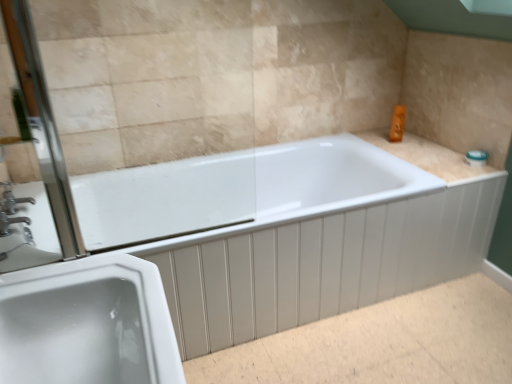
Locate an element on the screen. clear glass screen door at left is located at coordinates (42, 125).

What is the approximate height of clear glass screen door at left?

clear glass screen door at left is 30.35 inches in height.

You are a GUI agent. You are given a task and a screenshot of the screen. Output one action in this format:
    pyautogui.click(x=<x>, y=<y>)
    Task: Click on the white glossy sink at lower left
    This screenshot has width=512, height=384.
    Given the screenshot: What is the action you would take?
    pyautogui.click(x=87, y=324)

The width and height of the screenshot is (512, 384). What do you see at coordinates (432, 158) in the screenshot?
I see `beige tile counter top at upper right` at bounding box center [432, 158].

What are the coordinates of `clear glass screen door at left` in the screenshot? It's located at (42, 125).

The height and width of the screenshot is (384, 512). What are the coordinates of `sink above the silver metallic faucet at left (from a real-world perspective)` in the screenshot? It's located at (87, 324).

Considering the points (16, 210) and (29, 313), which point is behind, point (16, 210) or point (29, 313)?

The point (16, 210) is farther.

Would you say silver metallic faucet at left is inside or outside white glossy sink at lower left?

silver metallic faucet at left lies outside white glossy sink at lower left.

From the image's perspective, which one is positioned higher, silver metallic faucet at left or white glossy sink at lower left?

From the image's view, silver metallic faucet at left is above.

Find the location of `tap that is on the left side of white glossy bathtub at center`. tap that is on the left side of white glossy bathtub at center is located at coordinates (11, 209).

Could you tell me if white glossy bathtub at center is turned towards silver metallic faucet at left?

No, white glossy bathtub at center does not turn towards silver metallic faucet at left.

Can you confirm if white glossy bathtub at center is positioned to the left of silver metallic faucet at left?

Incorrect, white glossy bathtub at center is not on the left side of silver metallic faucet at left.

Is clear glass screen door at left far from silver metallic faucet at left?

No, clear glass screen door at left is in close proximity to silver metallic faucet at left.

In the scene shown: Is clear glass screen door at left thinner than silver metallic faucet at left?

Yes, clear glass screen door at left is thinner than silver metallic faucet at left.

Who is bigger, clear glass screen door at left or silver metallic faucet at left?

Bigger between the two is clear glass screen door at left.

Does white glossy sink at lower left touch beige tile counter top at upper right?

There is a gap between white glossy sink at lower left and beige tile counter top at upper right.

From the image's perspective, would you say white glossy sink at lower left is positioned over beige tile counter top at upper right?

No.

Is point (93, 304) closer to camera compared to point (433, 162)?

Yes.

There is a white glossy bathtub at center. Find the location of `counter top above it (from a real-world perspective)`. counter top above it (from a real-world perspective) is located at coordinates (432, 158).

Is white glossy bathtub at center turned away from beige tile counter top at upper right?

No, white glossy bathtub at center is not facing away from beige tile counter top at upper right.

Relative to beige tile counter top at upper right, is white glossy bathtub at center in front or behind?

white glossy bathtub at center is positioned closer to the viewer than beige tile counter top at upper right.

From the image's perspective, is white glossy bathtub at center beneath beige tile counter top at upper right?

Yes, from the image's perspective, white glossy bathtub at center is beneath beige tile counter top at upper right.

From a real-world perspective, who is located lower, white glossy bathtub at center or white glossy sink at lower left?

white glossy bathtub at center, from a real-world perspective.

The image size is (512, 384). In order to click on sink above the white glossy bathtub at center (from a real-world perspective) in this screenshot , I will do `click(87, 324)`.

Can you confirm if white glossy bathtub at center is positioned to the left of white glossy sink at lower left?

No.

Who is bigger, white glossy bathtub at center or white glossy sink at lower left?

With larger size is white glossy bathtub at center.

Can you tell me how much clear glass screen door at left and white glossy bathtub at center differ in facing direction?

clear glass screen door at left and white glossy bathtub at center are facing 0.0368 degrees away from each other.

From the image's perspective, is clear glass screen door at left located above white glossy bathtub at center?

Indeed, from the image's perspective, clear glass screen door at left is shown above white glossy bathtub at center.

Considering the positions of points (46, 178) and (266, 223), is point (46, 178) closer to camera compared to point (266, 223)?

Yes, point (46, 178) is closer to viewer.

Between clear glass screen door at left and white glossy bathtub at center, which one has less height?

With less height is white glossy bathtub at center.

Where is `sink on the right of silver metallic faucet at left`? sink on the right of silver metallic faucet at left is located at coordinates (87, 324).

The image size is (512, 384). I want to click on tap lying behind the white glossy bathtub at center, so click(11, 209).

When comparing their distances from beige tile counter top at upper right, does white glossy sink at lower left or silver metallic faucet at left seem further?

Among the two, silver metallic faucet at left is located further to beige tile counter top at upper right.

Based on their spatial positions, is silver metallic faucet at left or white glossy bathtub at center closer to beige tile counter top at upper right?

white glossy bathtub at center is positioned closer to the anchor beige tile counter top at upper right.

Estimate the real-world distances between objects in this image. Which object is closer to white glossy sink at lower left, silver metallic faucet at left or beige tile counter top at upper right?

silver metallic faucet at left is closer to white glossy sink at lower left.

Which object lies further to the anchor point beige tile counter top at upper right, clear glass screen door at left or silver metallic faucet at left?

silver metallic faucet at left is further to beige tile counter top at upper right.

Based on their spatial positions, is white glossy bathtub at center or beige tile counter top at upper right further from silver metallic faucet at left?

Among the two, beige tile counter top at upper right is located further to silver metallic faucet at left.

When comparing their distances from silver metallic faucet at left, does beige tile counter top at upper right or clear glass screen door at left seem closer?

clear glass screen door at left is positioned closer to the anchor silver metallic faucet at left.

When comparing their distances from beige tile counter top at upper right, does silver metallic faucet at left or clear glass screen door at left seem closer?

clear glass screen door at left is closer to beige tile counter top at upper right.

Estimate the real-world distances between objects in this image. Which object is further from silver metallic faucet at left, white glossy sink at lower left or clear glass screen door at left?

white glossy sink at lower left.

The width and height of the screenshot is (512, 384). In order to click on bathtub located between clear glass screen door at left and beige tile counter top at upper right in the left-right direction in this screenshot , I will do `click(330, 243)`.

Where is `bathtub between white glossy sink at lower left and beige tile counter top at upper right from left to right`? bathtub between white glossy sink at lower left and beige tile counter top at upper right from left to right is located at coordinates (330, 243).

You are a GUI agent. You are given a task and a screenshot of the screen. Output one action in this format:
    pyautogui.click(x=<x>, y=<y>)
    Task: Click on the screen door located between white glossy sink at lower left and white glossy bathtub at center in the depth direction
    This screenshot has height=384, width=512.
    Given the screenshot: What is the action you would take?
    pyautogui.click(x=42, y=125)

At what (x,y) coordinates should I click in order to perform the action: click on sink between clear glass screen door at left and beige tile counter top at upper right from left to right. Please return your answer as a coordinate pair (x, y). The height and width of the screenshot is (384, 512). Looking at the image, I should click on (87, 324).